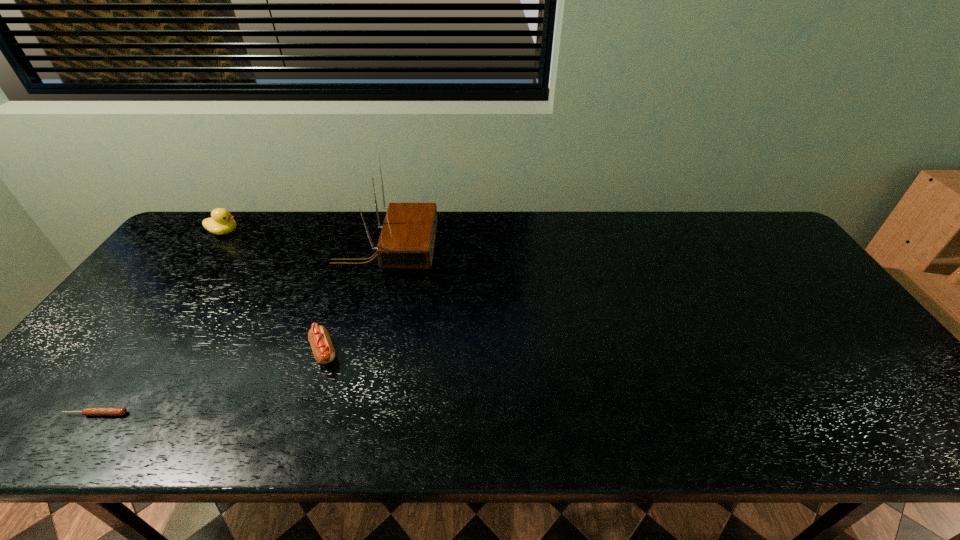
You are a GUI agent. You are given a task and a screenshot of the screen. Output one action in this format:
    pyautogui.click(x=<x>, y=<y>)
    Task: Click on the tallest object
    
    Given the screenshot: What is the action you would take?
    pyautogui.click(x=407, y=238)

I want to click on the third shortest object, so click(221, 222).

Locate an element on the screen. The width and height of the screenshot is (960, 540). the farther sausage is located at coordinates (318, 336).

I want to click on the second nearest object, so click(318, 336).

You are a GUI agent. You are given a task and a screenshot of the screen. Output one action in this format:
    pyautogui.click(x=<x>, y=<y>)
    Task: Click on the left sausage
    The image size is (960, 540).
    Given the screenshot: What is the action you would take?
    pyautogui.click(x=86, y=411)

The height and width of the screenshot is (540, 960). What are the coordinates of `the nearer sausage` in the screenshot? It's located at (86, 411).

Where is `vacant area located 0.180m on the front panel of the tallest object`? The width and height of the screenshot is (960, 540). vacant area located 0.180m on the front panel of the tallest object is located at coordinates (492, 248).

Find the location of a particular element. This screenshot has width=960, height=540. vacant region located on the beak of the second tallest object is located at coordinates [264, 232].

Image resolution: width=960 pixels, height=540 pixels. I want to click on free space located 0.320m on the right of the farther sausage, so click(x=468, y=352).

You are a GUI agent. You are given a task and a screenshot of the screen. Output one action in this format:
    pyautogui.click(x=<x>, y=<y>)
    Task: Click on the free spot located on the back of the left sausage
    The height and width of the screenshot is (540, 960).
    Given the screenshot: What is the action you would take?
    pyautogui.click(x=173, y=307)